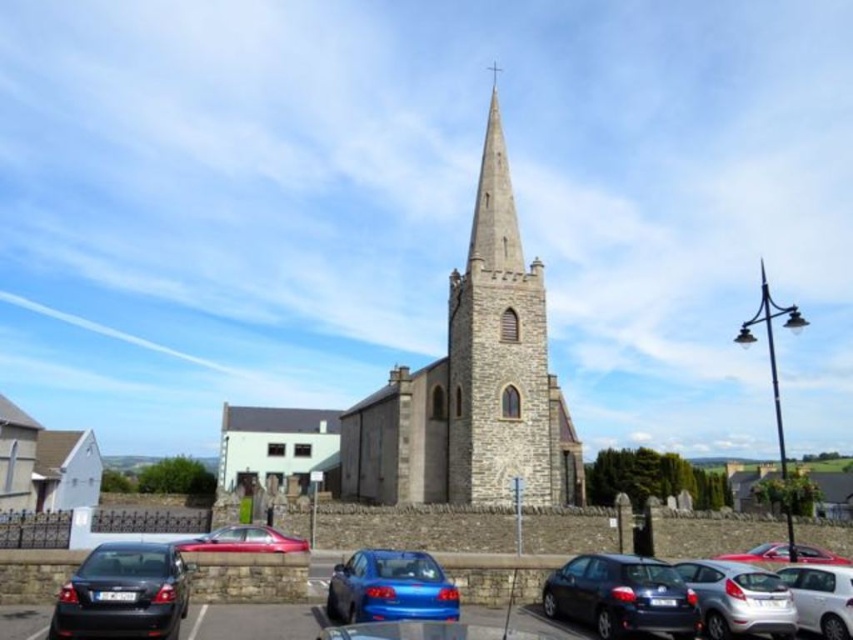
Question: Is matte black car at lower right below glossy metallic car at lower right?

Choices:
 (A) yes
 (B) no

Answer: (B)

Question: Which point appears closest to the camera in this image?

Choices:
 (A) (276, 561)
 (B) (715, 624)
 (C) (271, 536)
 (D) (552, 612)

Answer: (B)

Question: Which object is the farthest from the white matte car at lower right?

Choices:
 (A) glossy metallic car at lower left
 (B) gray stone steeple at center

Answer: (A)

Question: Is gray stone steeple at center positioned behind glossy blue sedan at lower center?

Choices:
 (A) yes
 (B) no

Answer: (A)

Question: Observing the image, what is the correct spatial positioning of matte black car at lower right in reference to glossy metallic car at lower right?

Choices:
 (A) above
 (B) below

Answer: (A)

Question: Which object is positioned farthest from the matte black car at lower left?

Choices:
 (A) stone steeple at center
 (B) glossy blue sedan at lower center
 (C) glossy metallic car at lower left
 (D) glossy metallic car at lower right

Answer: (A)